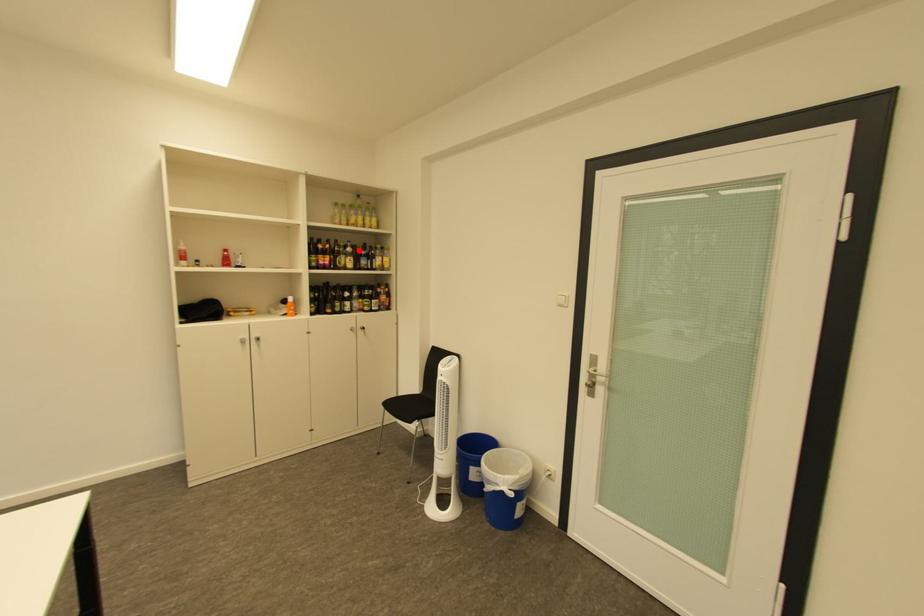
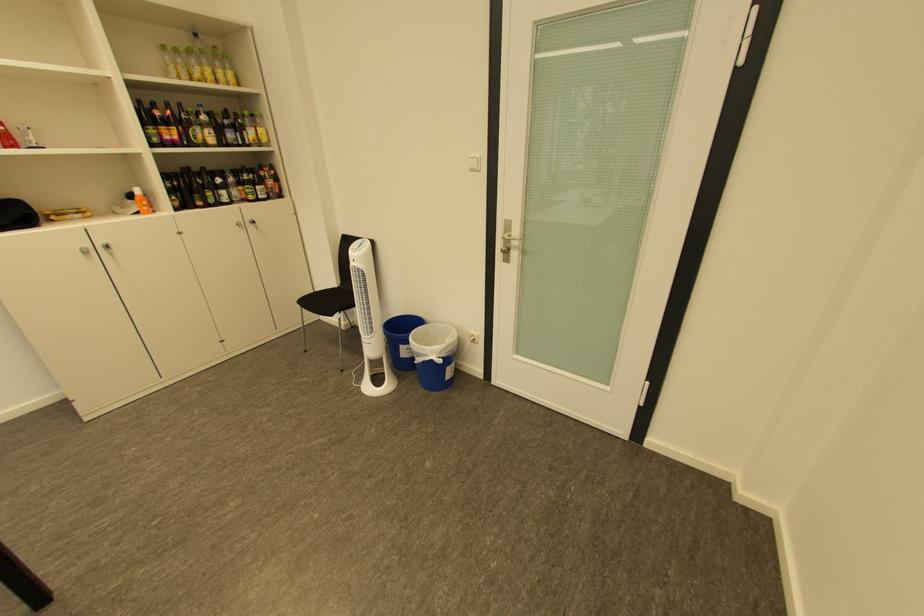
Find the pixel in the second image that matches the highlighted location in the first image.

(213, 119)